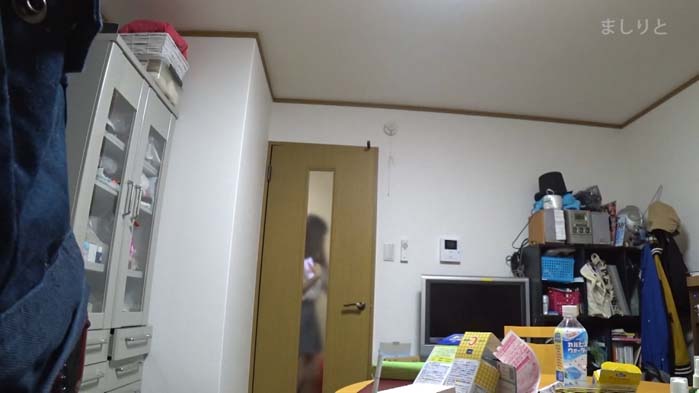
Where is `see through area on door`? The height and width of the screenshot is (393, 699). see through area on door is located at coordinates (324, 182), (317, 239), (314, 312), (309, 352), (309, 377).